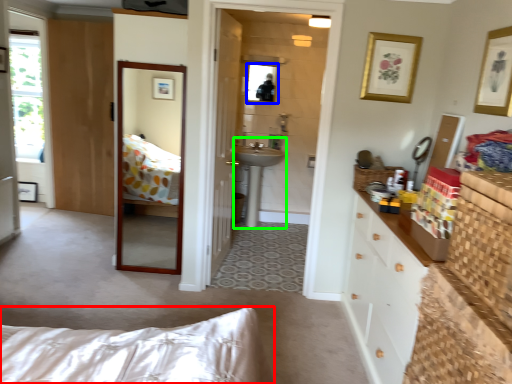
Question: Which is farther away from bed (highlighted by a red box)? mirror (highlighted by a blue box) or sink (highlighted by a green box)?

Choices:
 (A) mirror
 (B) sink

Answer: (A)